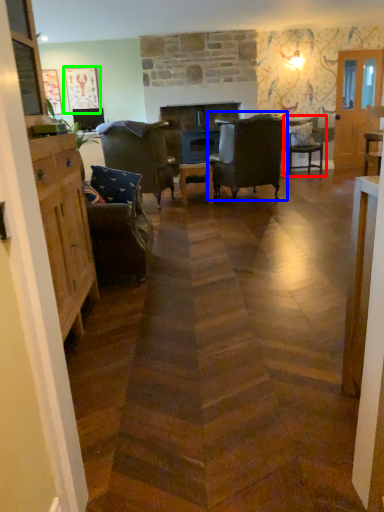
Question: Estimate the real-world distances between objects in this image. Which object is closer to chair (highlighted by a red box), chair (highlighted by a blue box) or picture frame (highlighted by a green box)?

Choices:
 (A) chair
 (B) picture frame

Answer: (A)